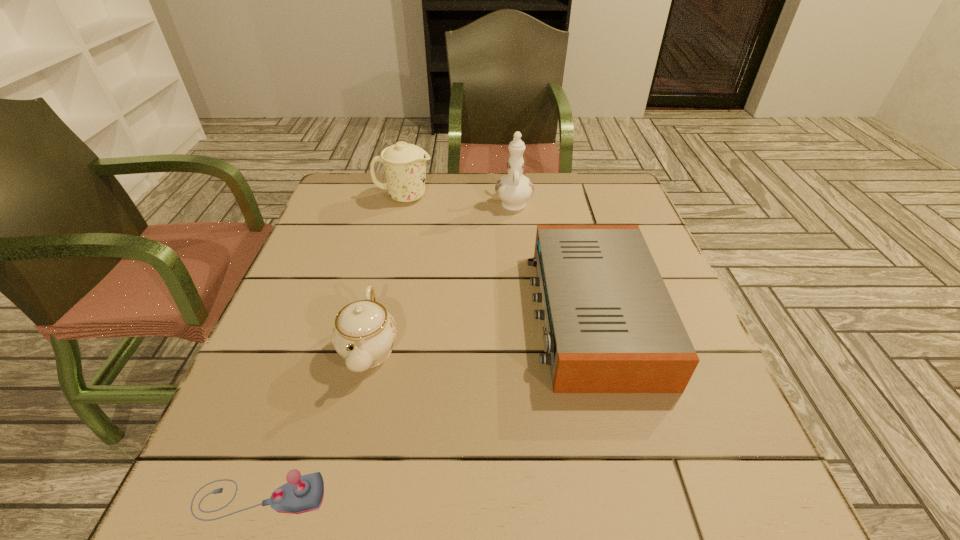
Find the location of a particular element. the tallest object is located at coordinates (514, 189).

At what (x,y) coordinates should I click in order to perform the action: click on the rightmost chinaware. Please return your answer as a coordinate pair (x, y). Looking at the image, I should click on (514, 189).

The height and width of the screenshot is (540, 960). In order to click on the second shortest chinaware in this screenshot , I will do `click(405, 164)`.

This screenshot has width=960, height=540. I want to click on the nearest chinaware, so click(x=364, y=333).

This screenshot has width=960, height=540. Identify the location of the shortest chinaware. (364, 333).

Identify the location of the fourth tallest object. (610, 324).

Where is `joystick`? joystick is located at coordinates (305, 493).

Image resolution: width=960 pixels, height=540 pixels. I want to click on the nearest object, so click(305, 493).

In order to click on free spot located on the spout of the fourth shortest object in this screenshot , I will do `click(534, 197)`.

Where is `vacant space located at the spout of the third tallest object`? The height and width of the screenshot is (540, 960). vacant space located at the spout of the third tallest object is located at coordinates (352, 424).